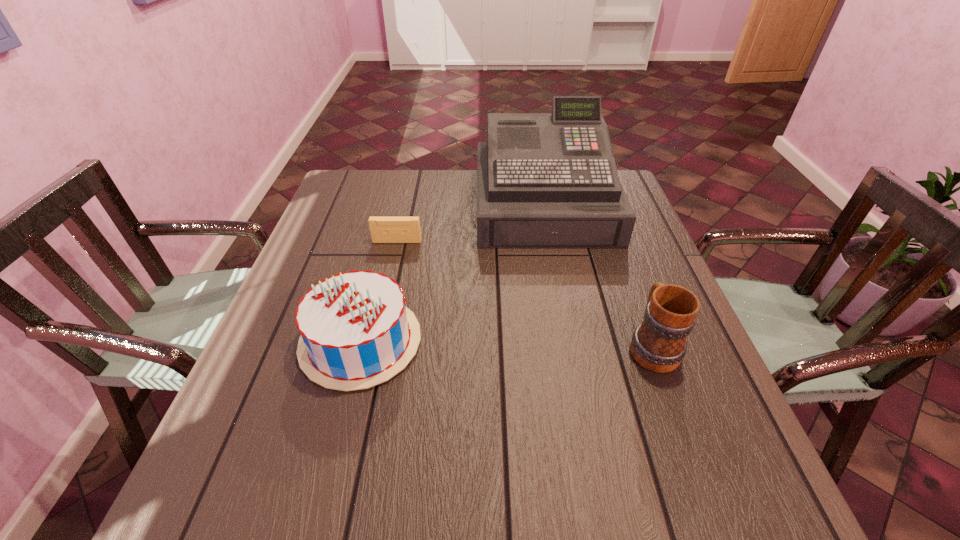
Locate an element on the screen. object at the far edge is located at coordinates (544, 180).

You are a GUI agent. You are given a task and a screenshot of the screen. Output one action in this format:
    pyautogui.click(x=<x>, y=<y>)
    Task: Click on the object present at the left edge
    
    Given the screenshot: What is the action you would take?
    pyautogui.click(x=356, y=332)

Find the location of a particular element. This screenshot has width=960, height=540. cash register at the right edge is located at coordinates click(544, 180).

This screenshot has width=960, height=540. I want to click on mug situated at the right edge, so click(658, 344).

Where is `object present at the far right corner`? The height and width of the screenshot is (540, 960). object present at the far right corner is located at coordinates (544, 180).

What are the coordinates of `vacant space at the near edge of the desktop` in the screenshot? It's located at [322, 476].

The height and width of the screenshot is (540, 960). In the image, there is a desktop. In order to click on vacant space at the left edge in this screenshot , I will do `click(270, 376)`.

At what (x,y) coordinates should I click in order to perform the action: click on blank space at the right edge of the desktop. Please return your answer as a coordinate pair (x, y). The height and width of the screenshot is (540, 960). Looking at the image, I should click on (715, 437).

This screenshot has width=960, height=540. Find the location of `vacant space at the far left corner of the desktop`. vacant space at the far left corner of the desktop is located at coordinates (342, 195).

You are a GUI agent. You are given a task and a screenshot of the screen. Output one action in this format:
    pyautogui.click(x=<x>, y=<y>)
    Task: Click on the vacant space in between the mug and the birthday cake
    Image resolution: width=960 pixels, height=540 pixels.
    Given the screenshot: What is the action you would take?
    pyautogui.click(x=506, y=343)